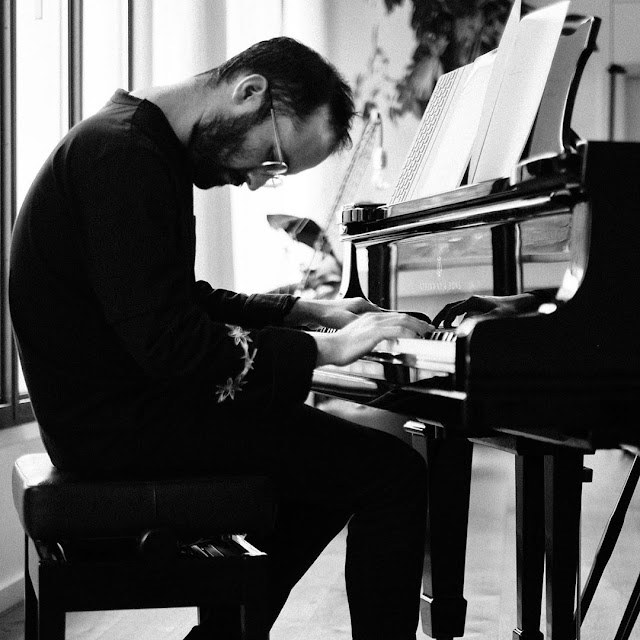
Where is `window`? The width and height of the screenshot is (640, 640). window is located at coordinates (43, 75).